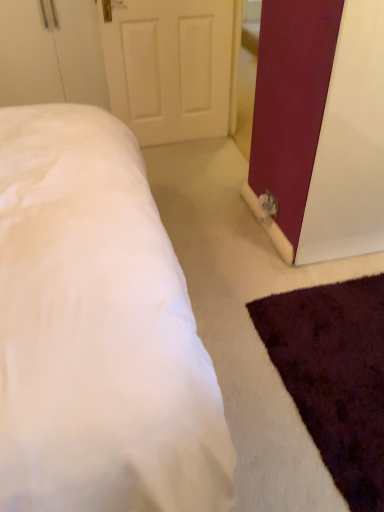
Question: Looking at their shapes, would you say matte burgundy barn door at right is wider or thinner than white matte door at upper center?

Choices:
 (A) thin
 (B) wide

Answer: (B)

Question: From the image's perspective, is matte burgundy barn door at right located above or below white matte door at upper center?

Choices:
 (A) below
 (B) above

Answer: (A)

Question: Which object is the farthest from the white matte door at upper center?

Choices:
 (A) matte burgundy barn door at right
 (B) white soft bed at lower left

Answer: (B)

Question: Estimate the real-world distances between objects in this image. Which object is closer to the matte burgundy barn door at right?

Choices:
 (A) white matte door at upper center
 (B) white soft bed at lower left

Answer: (B)